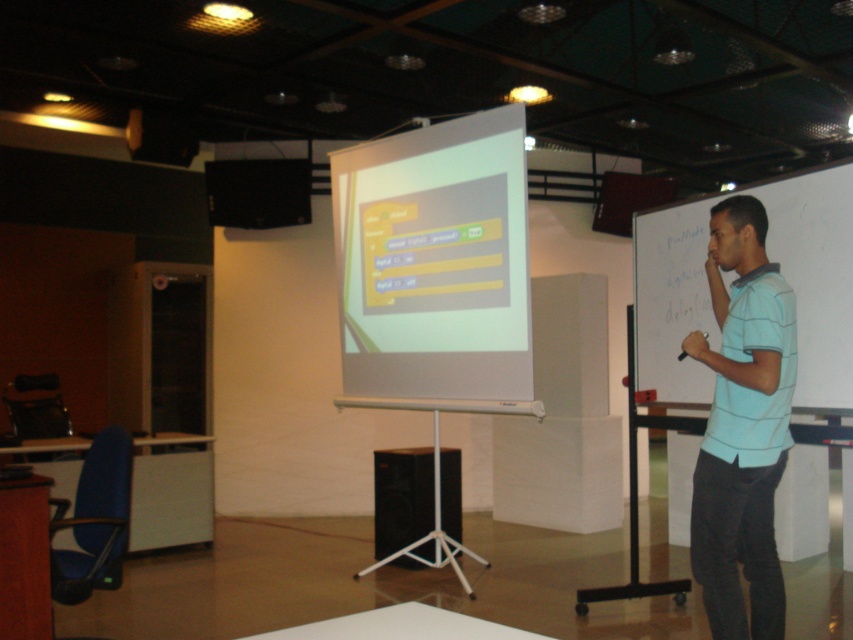
Question: Is white glossy projector screen at center further to the viewer compared to light blue striped shirt at right?

Choices:
 (A) no
 (B) yes

Answer: (B)

Question: Which object is closer to the camera taking this photo?

Choices:
 (A) light blue striped shirt at right
 (B) black plastic speaker at upper left
 (C) white glossy projector screen at center
 (D) black matte speaker at center

Answer: (A)

Question: Which point is farther to the camera?

Choices:
 (A) black matte speaker at center
 (B) light blue striped shirt at right

Answer: (A)

Question: Is white glossy projector screen at center to the right of black plastic speaker at upper left from the viewer's perspective?

Choices:
 (A) yes
 (B) no

Answer: (A)

Question: Can you confirm if white glossy projector screen at center is thinner than black matte speaker at center?

Choices:
 (A) yes
 (B) no

Answer: (B)

Question: Which of these objects is positioned farthest from the white glossy projector screen at center?

Choices:
 (A) light blue striped shirt at right
 (B) black plastic speaker at upper left

Answer: (B)